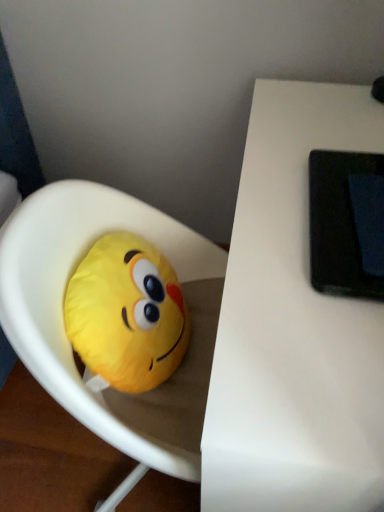
Question: Considering the positions of point [x=223, y=257] and point [x=112, y=370], is point [x=223, y=257] closer or farther from the camera than point [x=112, y=370]?

Choices:
 (A) farther
 (B) closer

Answer: (A)

Question: From a real-world perspective, is yellow fabric emoji pillow at left, arranged as the first toy when viewed from the right, positioned above or below yellow plush toy at left, placed as the 1th toy when sorted from left to right?

Choices:
 (A) below
 (B) above

Answer: (A)

Question: Which of these objects is positioned closest to the black matte tablet at upper right?

Choices:
 (A) white matte table at upper right
 (B) yellow plush toy at left, the 2th toy from the right
 (C) yellow fabric emoji pillow at left, marked as the 2th toy in a left-to-right arrangement

Answer: (A)

Question: Which of these objects is positioned farthest from the black matte tablet at upper right?

Choices:
 (A) yellow plush toy at left, placed as the 1th toy when sorted from left to right
 (B) white matte table at upper right
 (C) yellow fabric emoji pillow at left, arranged as the first toy when viewed from the right

Answer: (C)